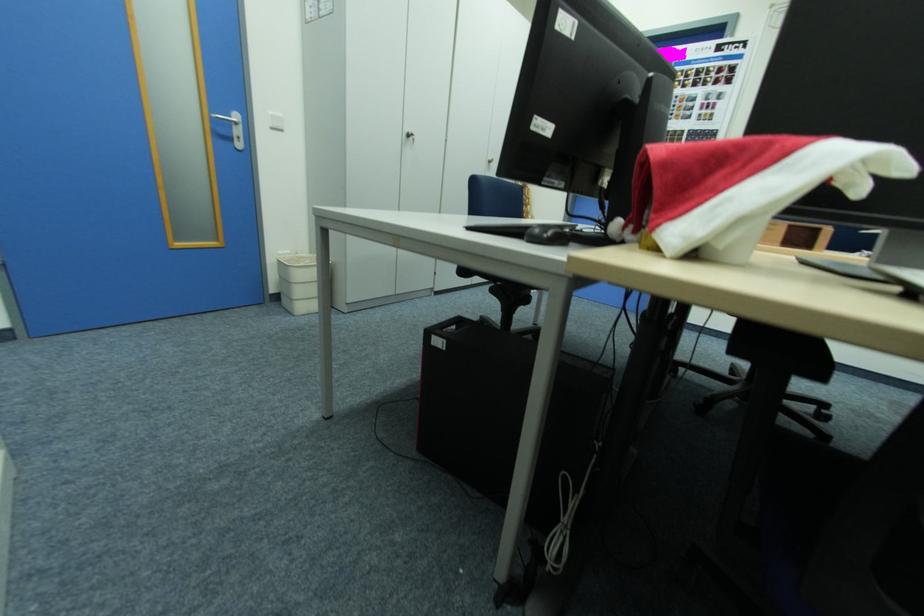
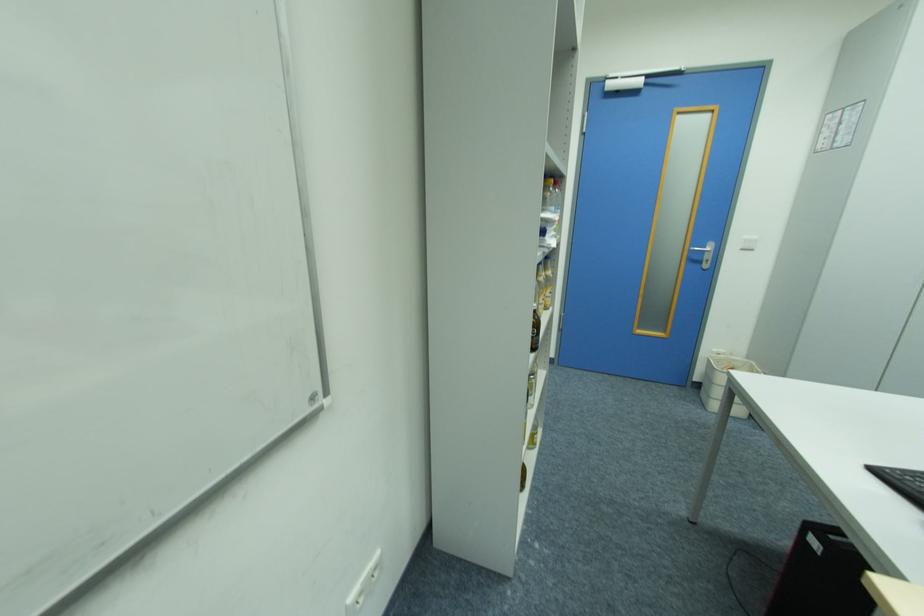
Question: The first image is from the beginning of the video and the second image is from the end. How did the camera likely rotate when shooting the video?

Choices:
 (A) Left
 (B) Right
 (C) Up
 (D) Down

Answer: (A)